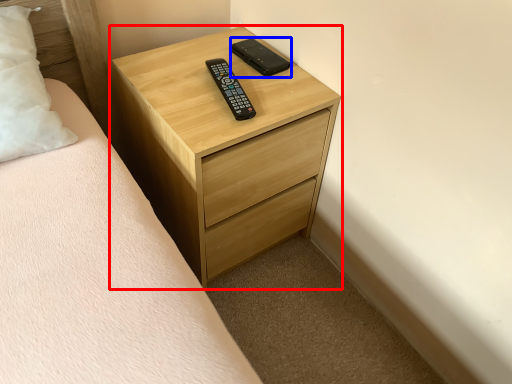
Question: Which of the following is the closest to the observer, chest of drawers (highlighted by a red box) or control (highlighted by a blue box)?

Choices:
 (A) chest of drawers
 (B) control

Answer: (A)